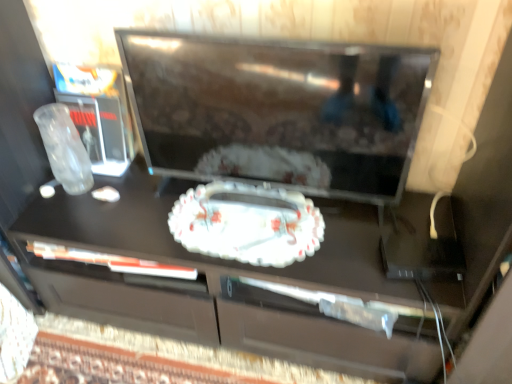
Describe the element at coordinates (247, 224) in the screenshot. The image size is (512, 384). I see `porcelain floral tray at center` at that location.

Where is `porcelain floral tray at center`? porcelain floral tray at center is located at coordinates (247, 224).

The image size is (512, 384). Find the location of `matte black tv at center`. matte black tv at center is located at coordinates (278, 111).

Describe the element at coordinates (278, 111) in the screenshot. I see `matte black tv at center` at that location.

Find the location of a particular element. The height and width of the screenshot is (384, 512). porcelain floral tray at center is located at coordinates (247, 224).

Is porcelain floral tray at center to the right of matte black tv at center from the viewer's perspective?

In fact, porcelain floral tray at center is to the left of matte black tv at center.

Considering the positions of objects porcelain floral tray at center and matte black tv at center in the image provided, who is behind, porcelain floral tray at center or matte black tv at center?

porcelain floral tray at center is more distant.

Is point (258, 207) more distant than point (228, 156)?

Yes.

From the image's perspective, is porcelain floral tray at center located above matte black tv at center?

No, from the image's perspective, porcelain floral tray at center is not over matte black tv at center.

From a real-world perspective, is porcelain floral tray at center positioned above or below matte black tv at center?

porcelain floral tray at center is below matte black tv at center.

Considering the sizes of objects porcelain floral tray at center and matte black tv at center in the image provided, who is wider, porcelain floral tray at center or matte black tv at center?

Wider between the two is porcelain floral tray at center.

Is porcelain floral tray at center taller or shorter than matte black tv at center?

porcelain floral tray at center is shorter than matte black tv at center.

Can you confirm if porcelain floral tray at center is bigger than matte black tv at center?

Actually, porcelain floral tray at center might be smaller than matte black tv at center.

Is porcelain floral tray at center positioned beyond the bounds of matte black tv at center?

No, porcelain floral tray at center is inside or overlapping with matte black tv at center.

Is porcelain floral tray at center far from matte black tv at center?

porcelain floral tray at center is near matte black tv at center, not far away.

Could you tell me if porcelain floral tray at center is facing matte black tv at center?

No, porcelain floral tray at center does not turn towards matte black tv at center.

Measure the distance from porcelain floral tray at center to matte black tv at center.

7.90 inches.

Locate an element on the screen. cake behind the matte black tv at center is located at coordinates (247, 224).

Does matte black tv at center appear on the right side of porcelain floral tray at center?

Correct, you'll find matte black tv at center to the right of porcelain floral tray at center.

Considering the positions of objects matte black tv at center and porcelain floral tray at center in the image provided, who is behind, matte black tv at center or porcelain floral tray at center?

porcelain floral tray at center is behind.

Is point (340, 97) closer or farther from the camera than point (221, 186)?

Point (340, 97) is positioned closer to the camera compared to point (221, 186).

From the image's perspective, relative to porcelain floral tray at center, is matte black tv at center above or below?

Clearly, from the image's perspective, matte black tv at center is above porcelain floral tray at center.

From a real-world perspective, who is located higher, matte black tv at center or porcelain floral tray at center?

In real-world perspective, matte black tv at center is above.

Considering the relative sizes of matte black tv at center and porcelain floral tray at center in the image provided, is matte black tv at center wider than porcelain floral tray at center?

In fact, matte black tv at center might be narrower than porcelain floral tray at center.

Between matte black tv at center and porcelain floral tray at center, which one has less height?

porcelain floral tray at center is shorter.

Which of these two, matte black tv at center or porcelain floral tray at center, is bigger?

Bigger between the two is matte black tv at center.

Would you say matte black tv at center contains porcelain floral tray at center?

Yes.

Is matte black tv at center beside porcelain floral tray at center?

No, matte black tv at center is not next to porcelain floral tray at center.

Is matte black tv at center oriented away from porcelain floral tray at center?

No, matte black tv at center's orientation is not away from porcelain floral tray at center.

How far apart are matte black tv at center and porcelain floral tray at center?

A distance of 20.06 centimeters exists between matte black tv at center and porcelain floral tray at center.

In order to click on cake below the matte black tv at center (from the image's perspective) in this screenshot , I will do `click(247, 224)`.

This screenshot has height=384, width=512. What are the coordinates of `cake below the matte black tv at center (from a real-world perspective)` in the screenshot? It's located at (247, 224).

Find the location of `television above the porcelain floral tray at center (from the image's perspective)`. television above the porcelain floral tray at center (from the image's perspective) is located at coordinates (278, 111).